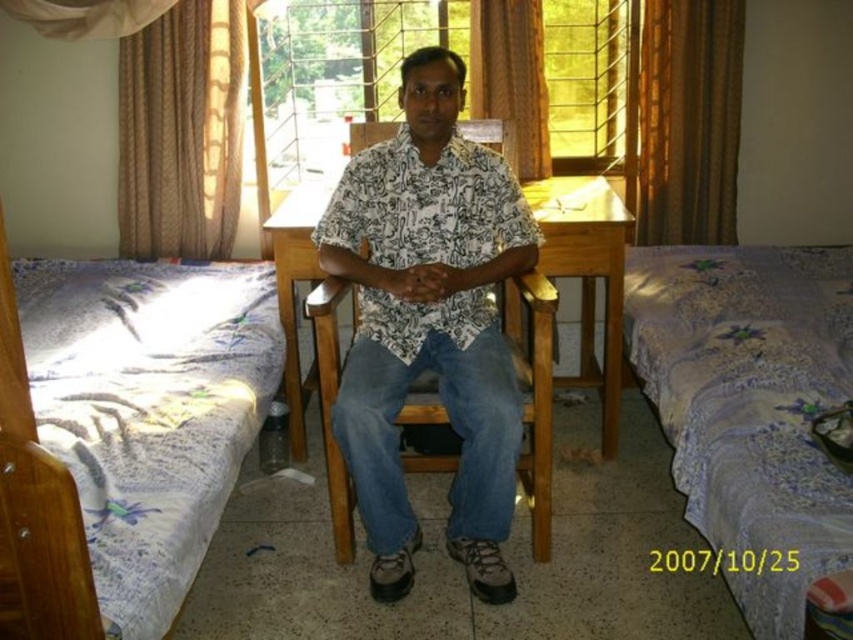
Does white printed shirt at center come behind linen bedspread at right?

That is True.

Is white printed shirt at center closer to camera compared to linen bedspread at right?

That is False.

Which is behind, point (483, 460) or point (741, 433)?

Point (483, 460)

Locate an element on the screen. Image resolution: width=853 pixels, height=640 pixels. white printed shirt at center is located at coordinates (428, 323).

Does brown fabric curtain at upper right have a greater width compared to wooden table at center?

Incorrect, brown fabric curtain at upper right's width does not surpass wooden table at center's.

Can you confirm if brown fabric curtain at upper right is thinner than wooden table at center?

Indeed, brown fabric curtain at upper right has a lesser width compared to wooden table at center.

Is point (659, 92) behind point (572, 196)?

Yes, point (659, 92) is behind point (572, 196).

Image resolution: width=853 pixels, height=640 pixels. In order to click on brown fabric curtain at upper right in this screenshot , I will do `click(689, 120)`.

Looking at this image, can you confirm if white printed shirt at center is positioned to the right of brown fabric curtain at upper center?

In fact, white printed shirt at center is to the left of brown fabric curtain at upper center.

Does white printed shirt at center appear over brown fabric curtain at upper center?

No.

Is point (471, 404) closer to camera compared to point (477, 72)?

Yes.

What are the coordinates of `white printed shirt at center` in the screenshot? It's located at (428, 323).